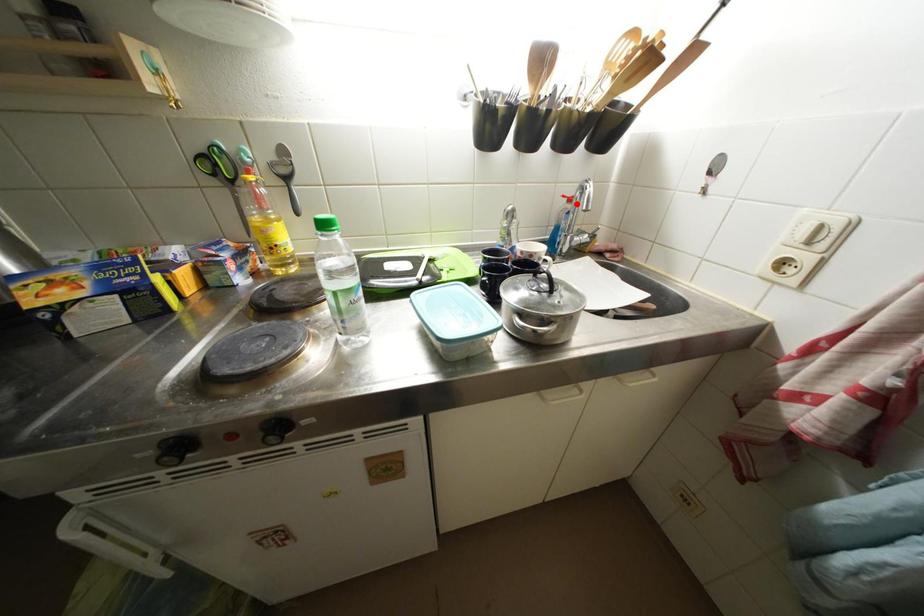
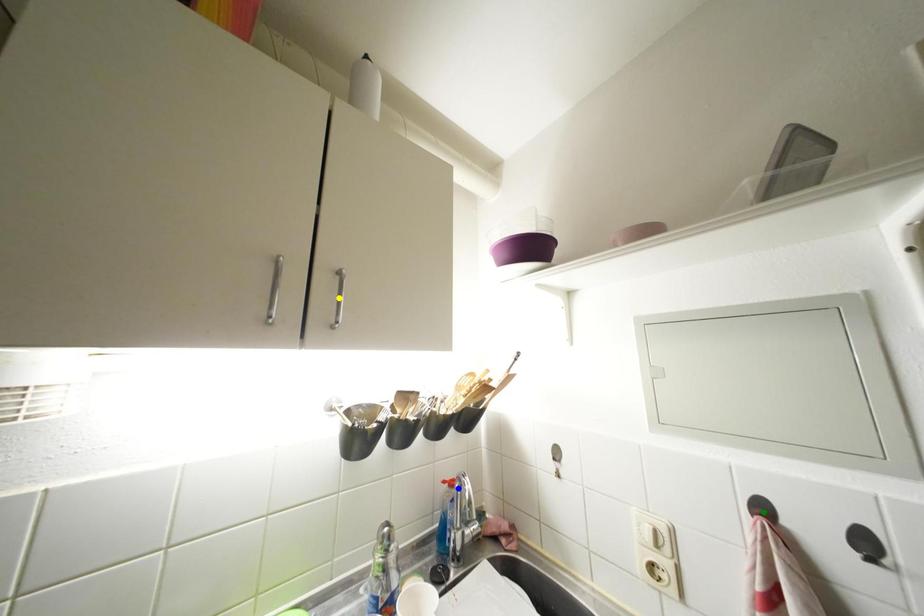
Question: I am providing you with two images of the same scene from different viewpoints. A red point is marked on the first image. You are given multiple points on the second image. In image 2, which mark is for the same physical point as the one in image 1?

Choices:
 (A) yellow point
 (B) green point
 (C) blue point

Answer: (C)